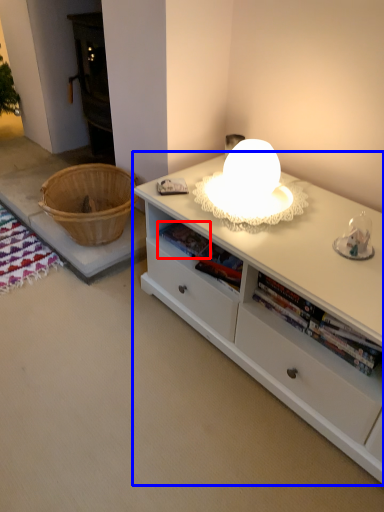
Question: Which object is further to the camera taking this photo, book (highlighted by a red box) or desk (highlighted by a blue box)?

Choices:
 (A) book
 (B) desk

Answer: (A)